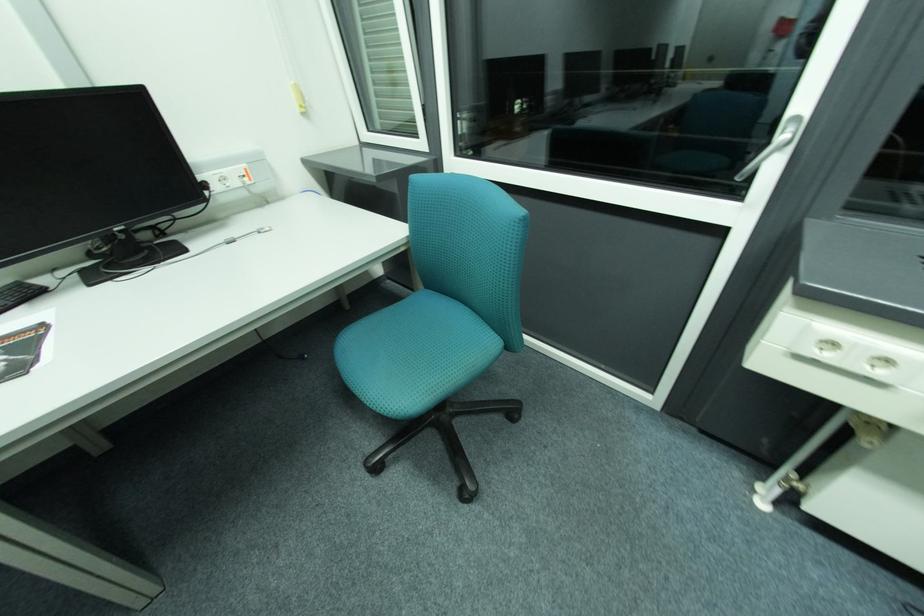
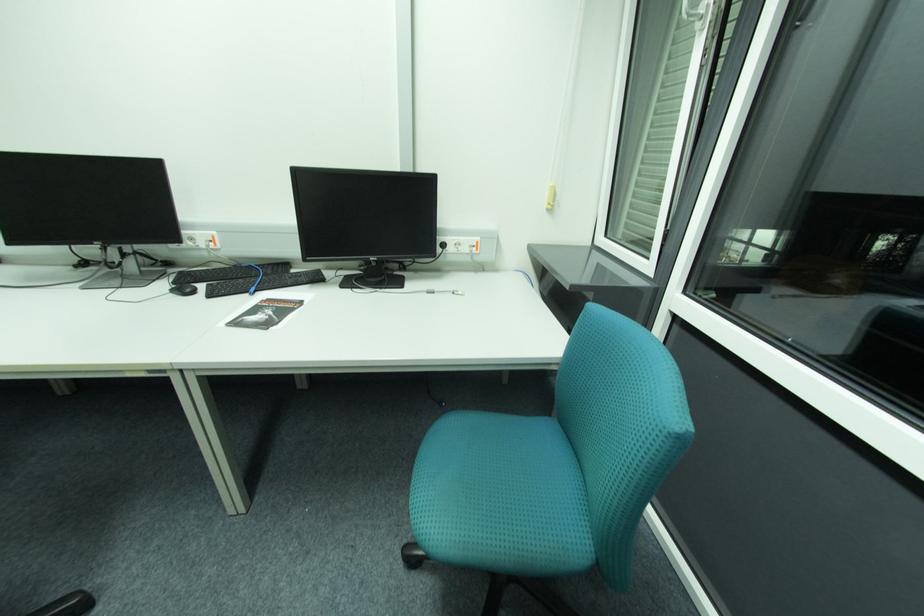
Question: Based on the continuous images, in which direction is the camera rotating? Reply with the corresponding letter.

Choices:
 (A) Left
 (B) Right
 (C) Up
 (D) Down

Answer: (A)